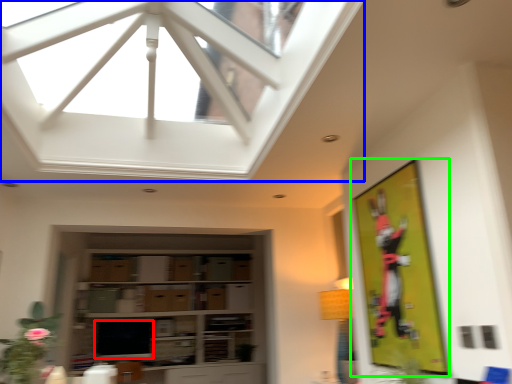
Question: Which is nearer to the window screen (highlighted by a red box)? window (highlighted by a blue box) or bulletin board (highlighted by a green box).

Choices:
 (A) window
 (B) bulletin board

Answer: (A)